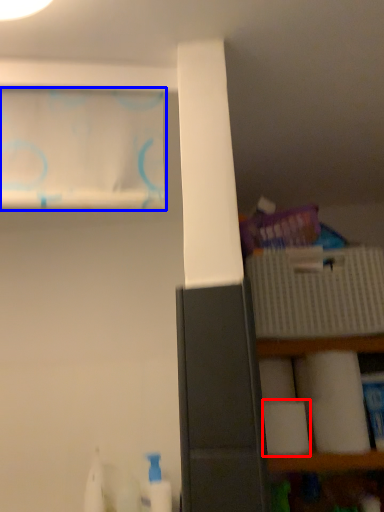
Question: Which object appears closest to the camera in this image, toilet paper (highlighted by a red box) or curtain (highlighted by a blue box)?

Choices:
 (A) toilet paper
 (B) curtain

Answer: (B)